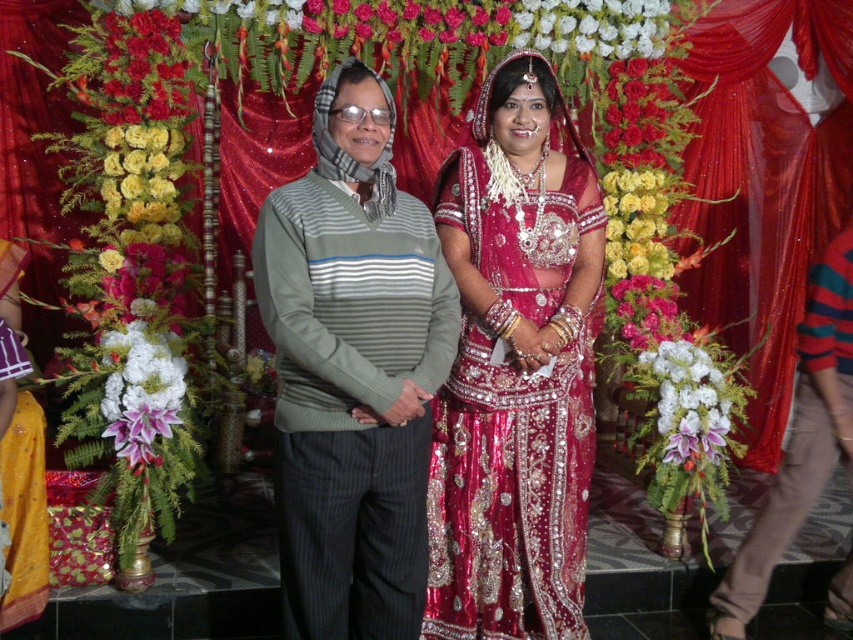
What is the position of the point labeled as point (352, 369) in relation to the shiny silk saree at center?

The point labeled as point (352, 369) is located on the shiny silk saree at center.

You are a photographer at the wedding and want to place a small decoration between the shiny red petals at upper left and the shiny red petals at upper right. Which petal should the decoration be closer to to ensure it fits properly?

The shiny red petals at upper left is smaller in size compared to the shiny red petals at upper right. Therefore, the decoration should be placed closer to the shiny red petals at upper left to accommodate its smaller size.